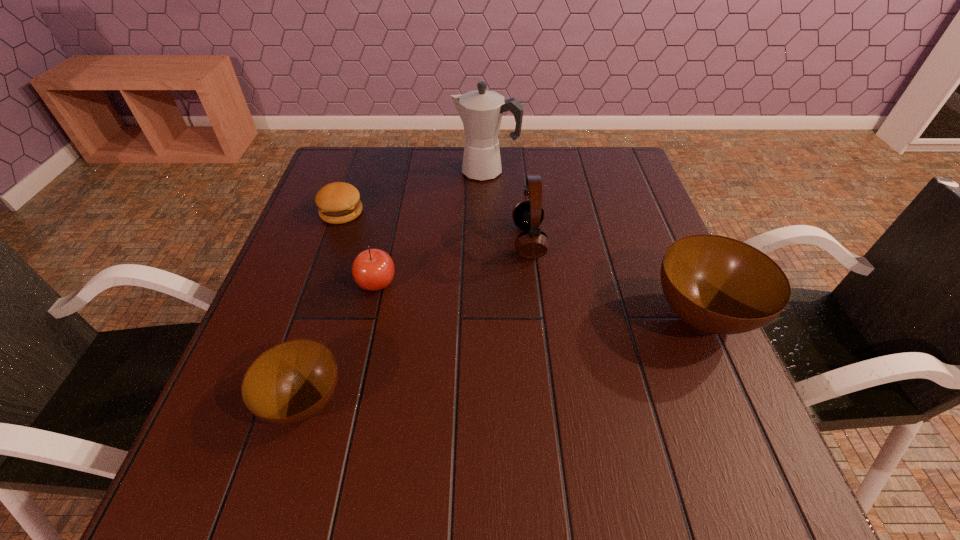
The height and width of the screenshot is (540, 960). I want to click on free space between the shorter bowl and the apple, so click(341, 342).

Locate an element on the screen. object identified as the fifth closest to the farther bowl is located at coordinates (338, 202).

Locate an element on the screen. Image resolution: width=960 pixels, height=540 pixels. object that stands as the second closest to the second tallest object is located at coordinates (719, 285).